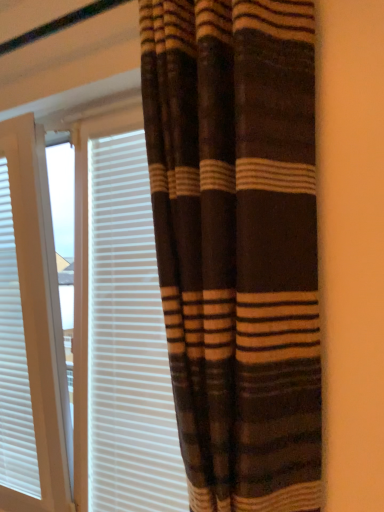
Measure the distance between point [206,262] and camera.

A distance of 27.44 inches exists between point [206,262] and camera.

In order to face white textured blinds at left, should I rotate leftwards or rightwards?

Turn left approximately 23.410 degrees to face it.

This screenshot has height=512, width=384. What are the coordinates of `white textured blinds at left` in the screenshot? It's located at (14, 364).

Locate an element on the screen. The height and width of the screenshot is (512, 384). white textured blinds at center is located at coordinates (127, 341).

Is white textured blinds at center not within brown striped curtain at center?

white textured blinds at center lies outside brown striped curtain at center's area.

Considering the positions of point (123, 402) and point (261, 190), is point (123, 402) closer or farther from the camera than point (261, 190)?

Point (123, 402).

Is the surface of white textured blinds at center in direct contact with brown striped curtain at center?

No, white textured blinds at center is not touching brown striped curtain at center.

Can white textured blinds at left be found inside brown striped curtain at center?

No, white textured blinds at left is not a part of brown striped curtain at center.

From the image's perspective, is brown striped curtain at center located above or below white textured blinds at left?

brown striped curtain at center is situated higher than white textured blinds at left in the image.

Is brown striped curtain at center bigger than white textured blinds at left?

Correct, brown striped curtain at center is larger in size than white textured blinds at left.

Is brown striped curtain at center facing away from white textured blinds at left?

brown striped curtain at center does not have its back to white textured blinds at left.

Does point (27, 365) lie in front of point (89, 275)?

That is False.

Is white textured blinds at left wider or thinner than white textured blinds at center?

Clearly, white textured blinds at left has more width compared to white textured blinds at center.

From a real-world perspective, which is physically below, white textured blinds at left or white textured blinds at center?

white textured blinds at left, from a real-world perspective.

Is white textured blinds at left positioned with its back to white textured blinds at center?

white textured blinds at left is not turned away from white textured blinds at center.

From a real-world perspective, which is physically below, white textured blinds at left or brown striped curtain at center?

In real-world perspective, white textured blinds at left is lower.

Is white textured blinds at left oriented towards brown striped curtain at center?

No.

Can you confirm if white textured blinds at left is wider than brown striped curtain at center?

In fact, white textured blinds at left might be narrower than brown striped curtain at center.

Based on their sizes in the image, would you say white textured blinds at left is bigger or smaller than brown striped curtain at center?

white textured blinds at left is smaller than brown striped curtain at center.

From a real-world perspective, which object rests below the other?

In real-world perspective, white textured blinds at center is lower.

How far apart are brown striped curtain at center and white textured blinds at center?

17.31 inches.

Is the position of brown striped curtain at center less distant than that of white textured blinds at center?

Yes, it is.

Which of these two, brown striped curtain at center or white textured blinds at center, is smaller?

white textured blinds at center is smaller.

Based on the photo, from a real-world perspective, is white textured blinds at center positioned above or below white textured blinds at left?

From a real-world perspective, white textured blinds at center is physically above white textured blinds at left.

The height and width of the screenshot is (512, 384). Find the location of `blind located above the white textured blinds at left (from a real-world perspective)`. blind located above the white textured blinds at left (from a real-world perspective) is located at coordinates (127, 341).

Looking at their sizes, would you say white textured blinds at center is wider or thinner than white textured blinds at left?

white textured blinds at center is thinner than white textured blinds at left.

Can you see white textured blinds at center touching white textured blinds at left?

No, white textured blinds at center is not in contact with white textured blinds at left.

You are a GUI agent. You are given a task and a screenshot of the screen. Output one action in this format:
    pyautogui.click(x=<x>, y=<y>)
    Task: Click on the blind below the brown striped curtain at center (from the image's perspective)
    The width and height of the screenshot is (384, 512).
    Given the screenshot: What is the action you would take?
    pyautogui.click(x=127, y=341)

At what (x,y) coordinates should I click in order to perform the action: click on curtain on the right of the white textured blinds at left. Please return your answer as a coordinate pair (x, y). The height and width of the screenshot is (512, 384). Looking at the image, I should click on (237, 244).

When comparing their distances from white textured blinds at center, does brown striped curtain at center or white textured blinds at left seem further?

brown striped curtain at center lies further to white textured blinds at center than the other object.

Estimate the real-world distances between objects in this image. Which object is closer to brown striped curtain at center, white textured blinds at center or white textured blinds at left?

white textured blinds at center is positioned closer to the anchor brown striped curtain at center.

Estimate the real-world distances between objects in this image. Which object is further from white textured blinds at center, white textured blinds at left or brown striped curtain at center?

Among the two, brown striped curtain at center is located further to white textured blinds at center.

When comparing their distances from brown striped curtain at center, does white textured blinds at left or white textured blinds at center seem further?

Answer: white textured blinds at left is positioned further to the anchor brown striped curtain at center.

Looking at this image, from the image, which object appears to be nearer to white textured blinds at left, brown striped curtain at center or white textured blinds at center?

Based on the image, white textured blinds at center appears to be nearer to white textured blinds at left.

Based on their spatial positions, is white textured blinds at center or brown striped curtain at center closer to white textured blinds at left?

white textured blinds at center.

You are a GUI agent. You are given a task and a screenshot of the screen. Output one action in this format:
    pyautogui.click(x=<x>, y=<y>)
    Task: Click on the blind positioned between brown striped curtain at center and white textured blinds at left from near to far
    The width and height of the screenshot is (384, 512).
    Given the screenshot: What is the action you would take?
    pyautogui.click(x=127, y=341)